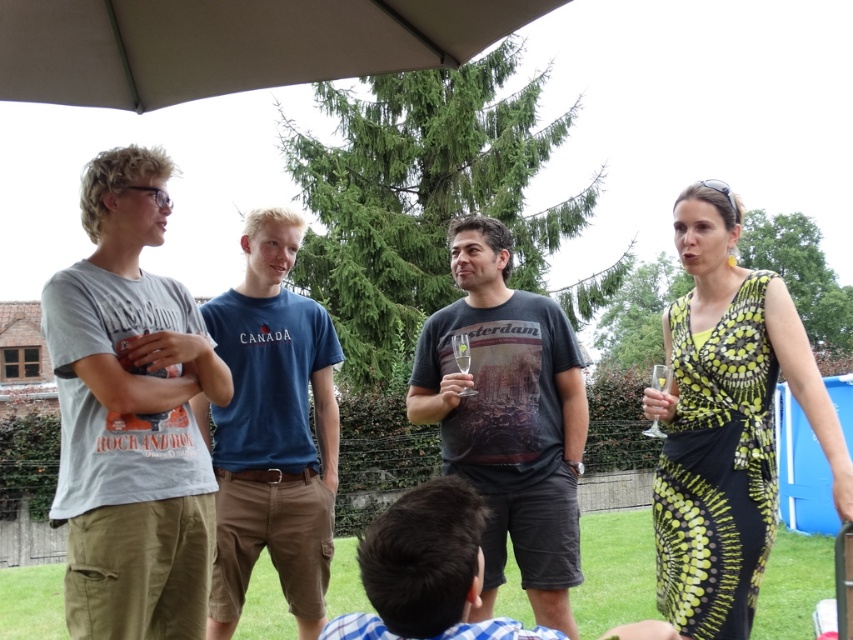
Question: Can you confirm if printed silk dress at right is positioned to the right of clear glass wine glass at right?

Choices:
 (A) no
 (B) yes

Answer: (A)

Question: Which point is closer to the camera?

Choices:
 (A) blue striped shirt at lower center
 (B) light gray cotton t-shirt at left
 (C) printed silk dress at right

Answer: (A)

Question: Does blue cotton t-shirt at center lie in front of clear glass wine glass at right?

Choices:
 (A) yes
 (B) no

Answer: (B)

Question: Which point is closer to the camera taking this photo?

Choices:
 (A) (457, 394)
 (B) (837, 512)
 (C) (223, 627)
 (D) (432, 22)

Answer: (B)

Question: Which of the following is the closest to the observer?

Choices:
 (A) printed silk dress at right
 (B) light gray cotton t-shirt at left

Answer: (A)

Question: Is light gray cotton t-shirt at left above clear glass wine glass at center?

Choices:
 (A) no
 (B) yes

Answer: (A)